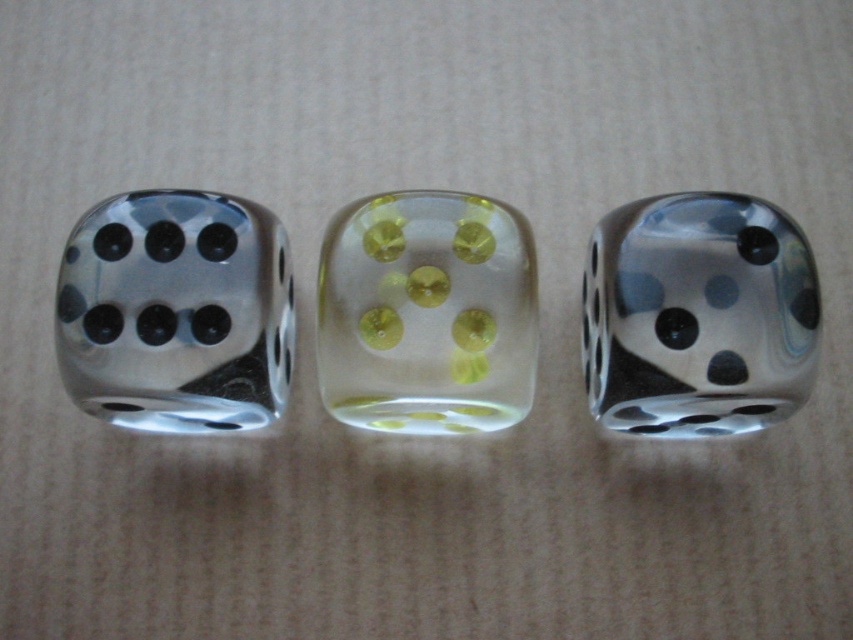
What are the coordinates of `transparent glass die at center` in the screenshot? It's located at (698, 316).

Between point (596, 296) and point (440, 211), which one is positioned behind?

The point (596, 296) is more distant.

Identify the location of transparent glass die at center. (698, 316).

Is translucent glass dice at left positioned at the back of transparent glass die at center?

That is True.

Is translucent glass dice at left bigger than transparent glass die at center?

Incorrect, translucent glass dice at left is not larger than transparent glass die at center.

This screenshot has height=640, width=853. Describe the element at coordinates (177, 312) in the screenshot. I see `translucent glass dice at left` at that location.

Where is `translucent glass dice at left`? Image resolution: width=853 pixels, height=640 pixels. translucent glass dice at left is located at coordinates (177, 312).

Does translucent glass dice at left lie behind translucent yellow-green dice at center?

No, translucent glass dice at left is in front of translucent yellow-green dice at center.

The image size is (853, 640). Find the location of `translucent glass dice at left`. translucent glass dice at left is located at coordinates (177, 312).

Image resolution: width=853 pixels, height=640 pixels. I want to click on translucent glass dice at left, so click(177, 312).

The image size is (853, 640). Find the location of `translucent glass dice at left`. translucent glass dice at left is located at coordinates (177, 312).